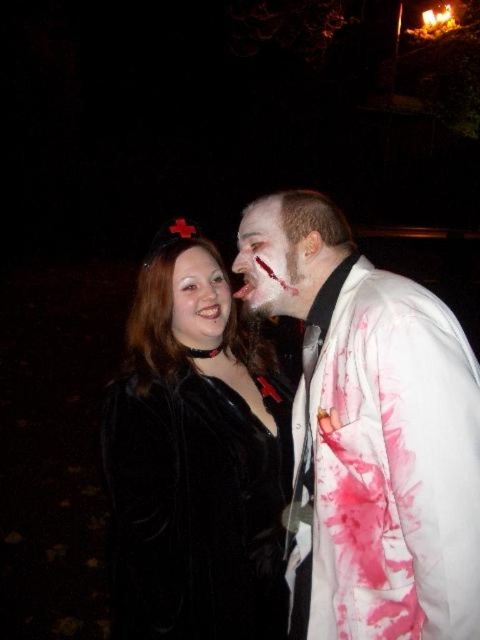
Which of these two, white matte jacket at right or blood-stained flesh at center, stands taller?

Standing taller between the two is white matte jacket at right.

Which is below, white matte jacket at right or blood-stained flesh at center?

white matte jacket at right

What do you see at coordinates (370, 433) in the screenshot? I see `white matte jacket at right` at bounding box center [370, 433].

You are a GUI agent. You are given a task and a screenshot of the screen. Output one action in this format:
    pyautogui.click(x=<x>, y=<y>)
    Task: Click on the white matte jacket at right
    
    Given the screenshot: What is the action you would take?
    pyautogui.click(x=370, y=433)

Based on the photo, who is positioned more to the right, blood-stained flesh at center or smooth black hair at center?

From the viewer's perspective, blood-stained flesh at center appears more on the right side.

Consider the image. Can you confirm if blood-stained flesh at center is positioned to the left of smooth black hair at center?

Incorrect, blood-stained flesh at center is not on the left side of smooth black hair at center.

What do you see at coordinates (265, 260) in the screenshot? The width and height of the screenshot is (480, 640). I see `blood-stained flesh at center` at bounding box center [265, 260].

The height and width of the screenshot is (640, 480). Identify the location of blood-stained flesh at center. (265, 260).

Who is more distant from viewer, [211,387] or [192,330]?

Positioned behind is point [192,330].

Is point (176, 342) less distant than point (189, 291)?

No, it is behind (189, 291).

Which is in front, point (250, 413) or point (182, 282)?

Positioned in front is point (182, 282).

The width and height of the screenshot is (480, 640). I want to click on velvet black coat at center, so click(194, 460).